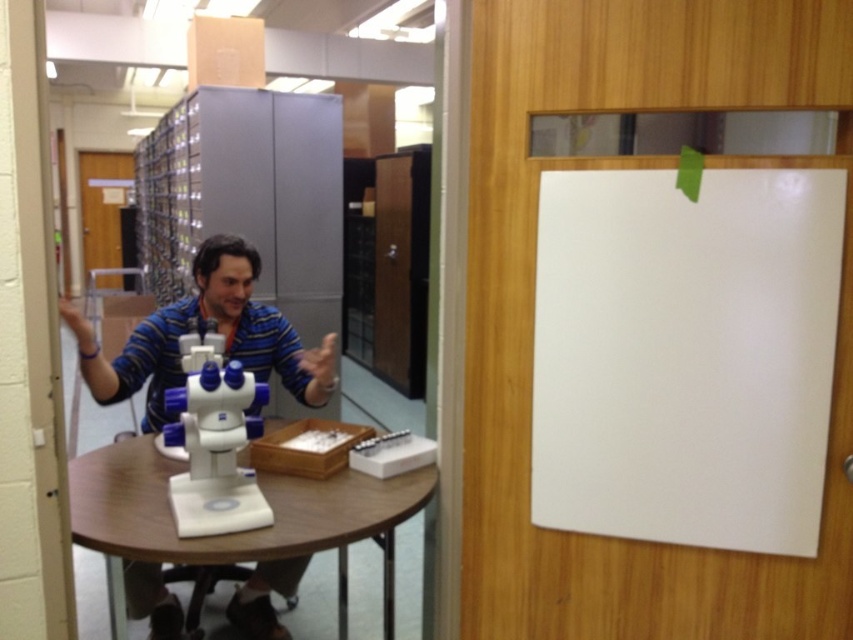
Question: Can you confirm if white matte board at upper right is positioned to the left of blue plastic microscope at center?

Choices:
 (A) yes
 (B) no

Answer: (B)

Question: Does white matte board at upper right appear on the left side of blue plastic microscope at center?

Choices:
 (A) no
 (B) yes

Answer: (A)

Question: Among these points, which one is farthest from the camera?

Choices:
 (A) (735, 481)
 (B) (177, 506)
 (C) (384, 561)
 (D) (276, 369)

Answer: (D)

Question: Which of these objects is positioned closest to the blue plastic microscope at center?

Choices:
 (A) white plastic round table at center
 (B) white plastic microscope at center

Answer: (B)

Question: Which object is closer to the camera taking this photo?

Choices:
 (A) white plastic round table at center
 (B) white plastic microscope at center
 (C) white matte board at upper right
 (D) blue plastic microscope at center

Answer: (D)

Question: Can you confirm if white plastic round table at center is thinner than blue plastic microscope at center?

Choices:
 (A) no
 (B) yes

Answer: (A)